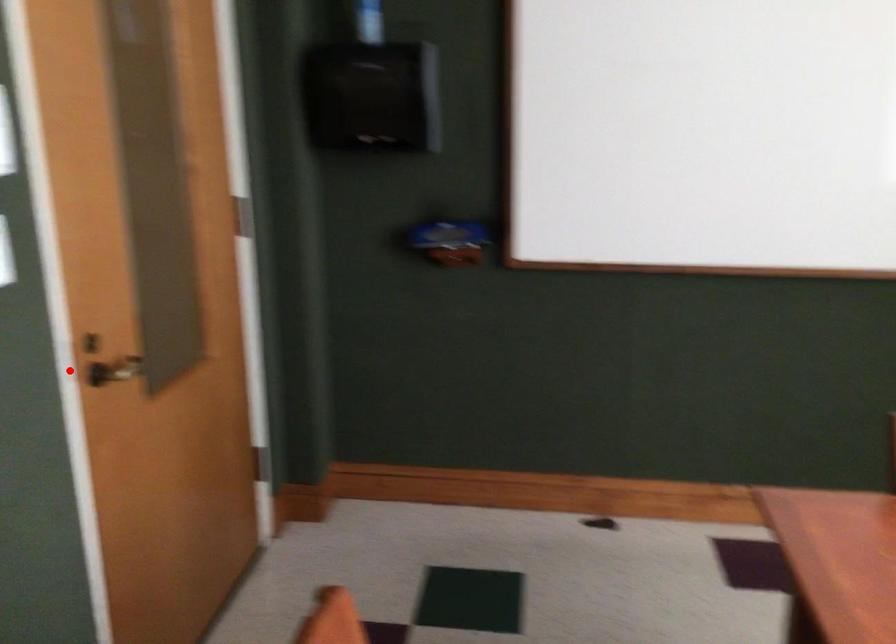
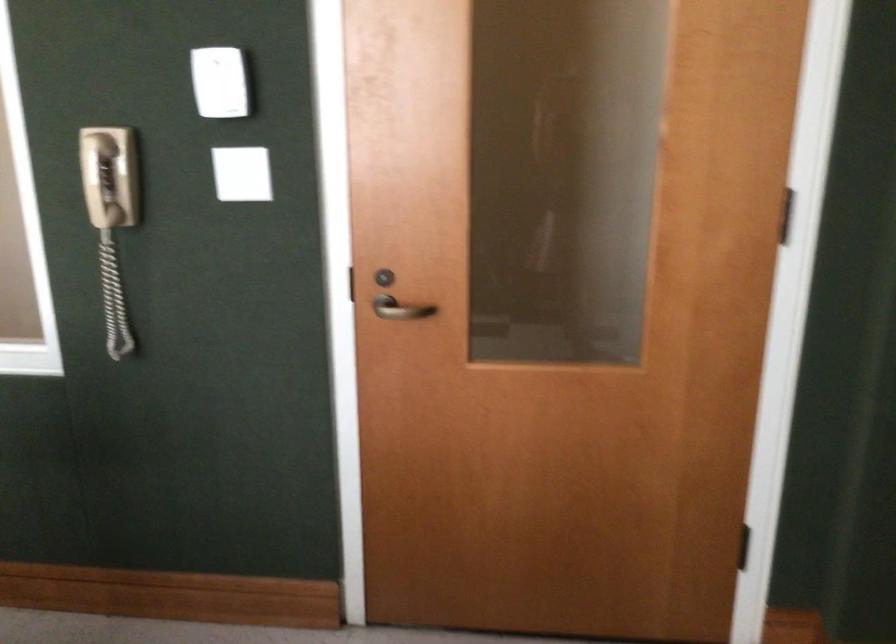
Question: I am providing you with two images of the same scene from different viewpoints. A red point is shown in image1. For the corresponding object point in image2, is it positioned nearer or farther from the camera?

Choices:
 (A) Nearer
 (B) Farther

Answer: (B)